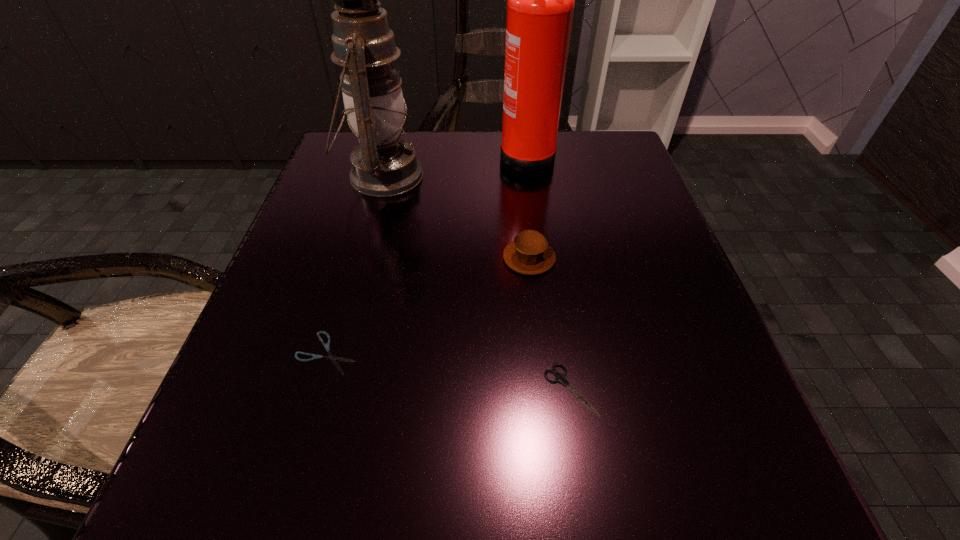
Identify the location of free space that satisfies the following two spatial constraints: 1. on the back side of the shortest object; 2. on the left side of the muffin. pos(354,258).

This screenshot has height=540, width=960. What are the coordinates of `vacant point that satisfies the following two spatial constraints: 1. on the back side of the muffin; 2. on the right side of the shorter shears` in the screenshot? It's located at (354, 258).

This screenshot has width=960, height=540. Identify the location of free space in the image that satisfies the following two spatial constraints: 1. at the nozzle of the right shears; 2. on the right side of the fire extinguisher. (559, 389).